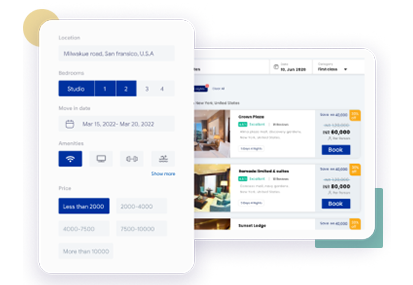
Where is `tv button`? The width and height of the screenshot is (413, 285). tv button is located at coordinates (101, 153).